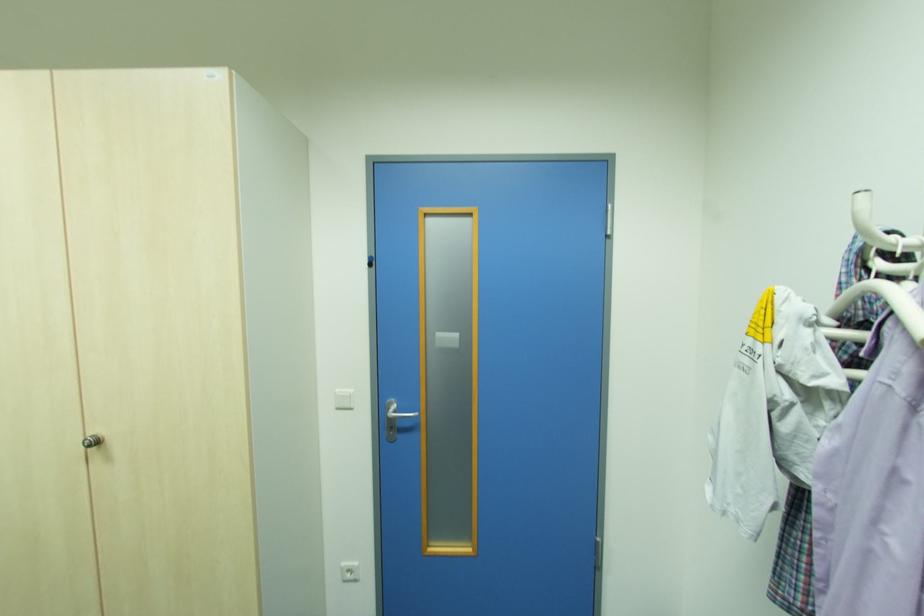
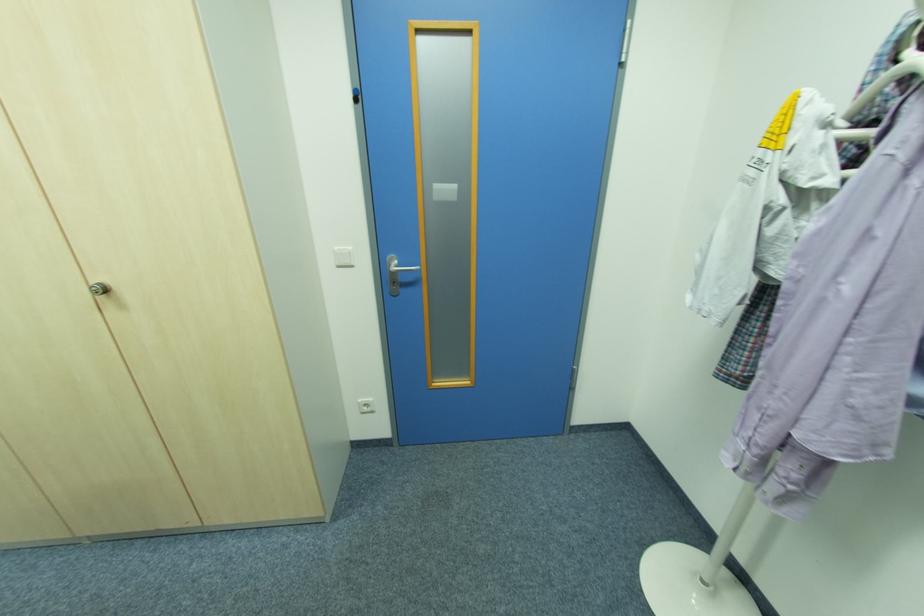
Find the pixel in the second image that matches point 347,569 in the first image.

(365, 403)